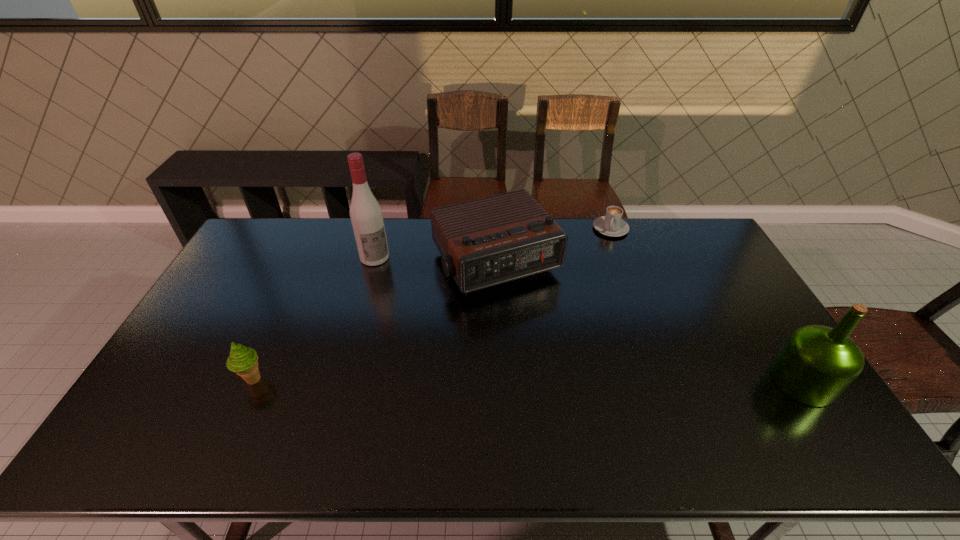
Find the location of a particular element. The image size is (960, 540). free region located to the right of the shortest object is located at coordinates (599, 266).

At what (x,y) coordinates should I click in order to perform the action: click on alcohol that is at the far edge. Please return your answer as a coordinate pair (x, y). Looking at the image, I should click on (366, 216).

Where is `radio receiver present at the far edge`? This screenshot has height=540, width=960. radio receiver present at the far edge is located at coordinates (489, 241).

You are a GUI agent. You are given a task and a screenshot of the screen. Output one action in this format:
    pyautogui.click(x=<x>, y=<y>)
    Task: Click on the cappuccino present at the far edge
    This screenshot has width=960, height=540.
    Given the screenshot: What is the action you would take?
    pyautogui.click(x=611, y=224)

Find the location of a particular element. Image resolution: width=960 pixels, height=540 pixels. icecream present at the near edge is located at coordinates (243, 361).

At what (x,y) coordinates should I click in order to perform the action: click on olive oil positioned at the near edge. Please return your answer as a coordinate pair (x, y). Looking at the image, I should click on (817, 363).

What are the coordinates of `object situated at the right edge` in the screenshot? It's located at (817, 363).

Locate an element on the screen. object positioned at the near right corner is located at coordinates (817, 363).

Locate an element on the screen. free spot at the far edge of the desktop is located at coordinates (431, 254).

Locate an element on the screen. Image resolution: width=960 pixels, height=540 pixels. vacant area at the near edge is located at coordinates (527, 399).